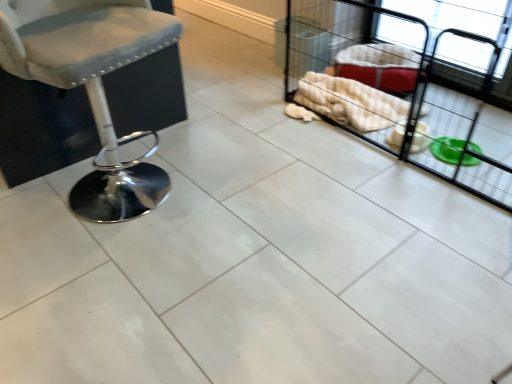
Locate an element on the screen. vacant region to the right of matte gray fabric stool at left is located at coordinates (226, 183).